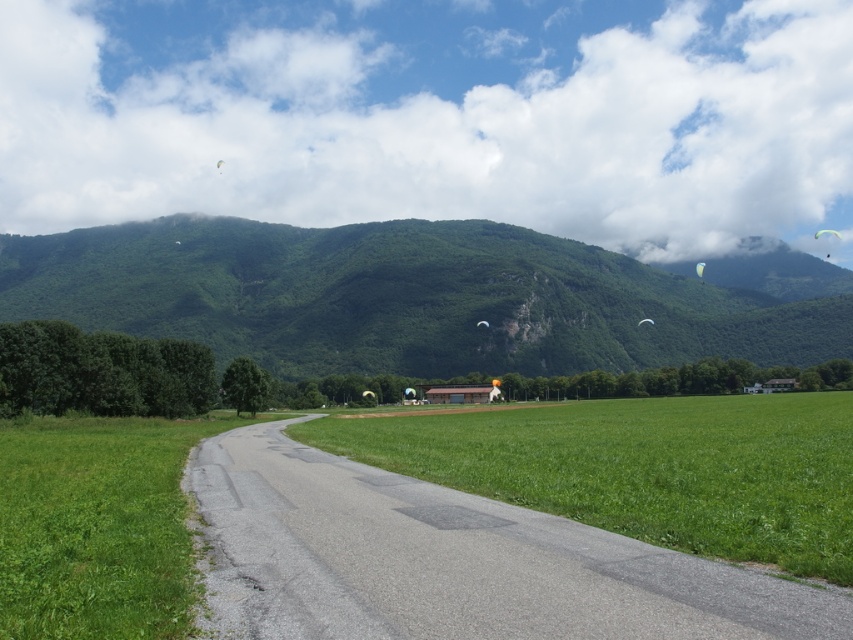
You are a hiker standing at the start of the road in the foreground. You see the green leafy mountain at center and the white fabric kite at upper right. Which object is higher in the image?

The green leafy mountain at center is taller than the white fabric kite at upper right.

You are a bird soaring in the sky. You see the green grass field at center and the white fabric kite at upper right. Which object is located lower in the scene?

The green grass field at center is located lower than the white fabric kite at upper right.

You are standing at the point marked as point (x=148, y=308) in the image. The nearest mountain peak is 200 meters away from you. Can you safely walk to the nearest mountain peak without crossing the road?

The distance of point (x=148, y=308) from viewer is 289.30 meters. Since the nearest mountain peak is only 200 meters away, you are already closer to the mountain than your current position. However, the road is in the foreground, so you would need to cross it to reach the mountain. Therefore, you cannot safely walk to the mountain peak without crossing the road.